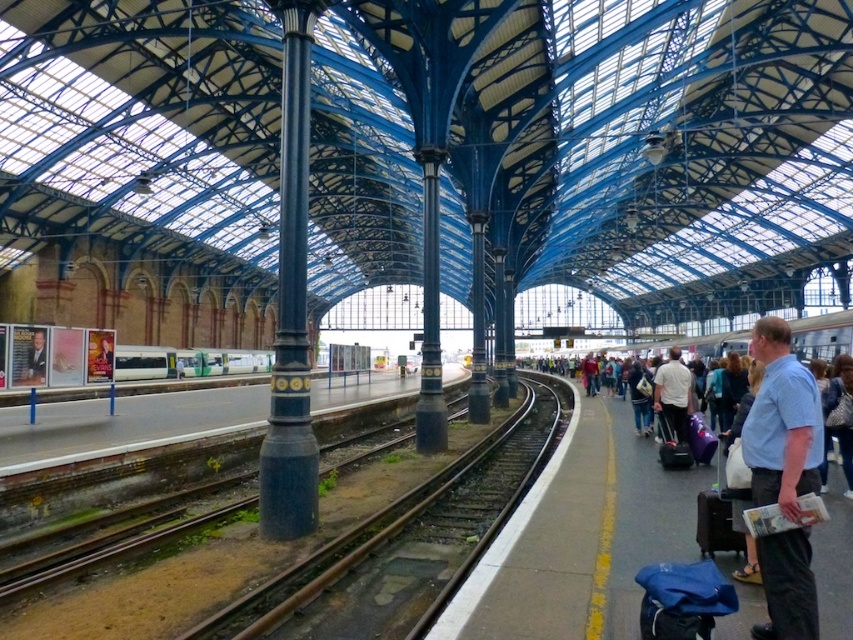
Is blue fabric suitcase at right bigger than white matte shirt at center-right?

Correct, blue fabric suitcase at right is larger in size than white matte shirt at center-right.

You are a GUI agent. You are given a task and a screenshot of the screen. Output one action in this format:
    pyautogui.click(x=<x>, y=<y>)
    Task: Click on the blue fabric suitcase at right
    The width and height of the screenshot is (853, 640).
    Given the screenshot: What is the action you would take?
    pyautogui.click(x=801, y=582)

This screenshot has height=640, width=853. In order to click on blue fabric suitcase at right in this screenshot , I will do `click(801, 582)`.

Where is `blue fabric suitcase at right`? The image size is (853, 640). blue fabric suitcase at right is located at coordinates (801, 582).

Can you confirm if light blue shirt at right is positioned to the left of black fabric suitcase at right?

Incorrect, light blue shirt at right is not on the left side of black fabric suitcase at right.

Which is more to the right, light blue shirt at right or black fabric suitcase at right?

Positioned to the right is light blue shirt at right.

Who is more forward, (799, 544) or (695, 516)?

Point (799, 544) is more forward.

What are the coordinates of `light blue shirt at right` in the screenshot? It's located at (782, 422).

Does light blue shirt at right have a lesser width compared to black hard suitcase at center-right?

No, light blue shirt at right is not thinner than black hard suitcase at center-right.

Identify the location of light blue shirt at right. (782, 422).